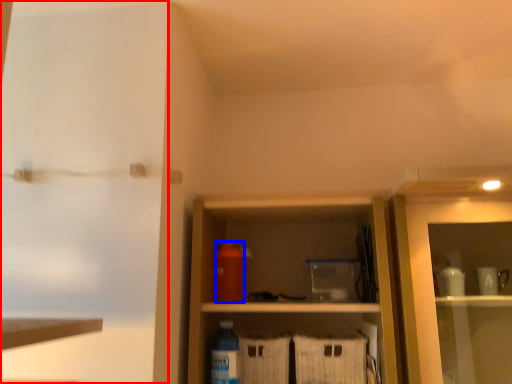
Question: Among these objects, which one is farthest to the camera, screen door (highlighted by a red box) or bottle (highlighted by a blue box)?

Choices:
 (A) screen door
 (B) bottle

Answer: (B)